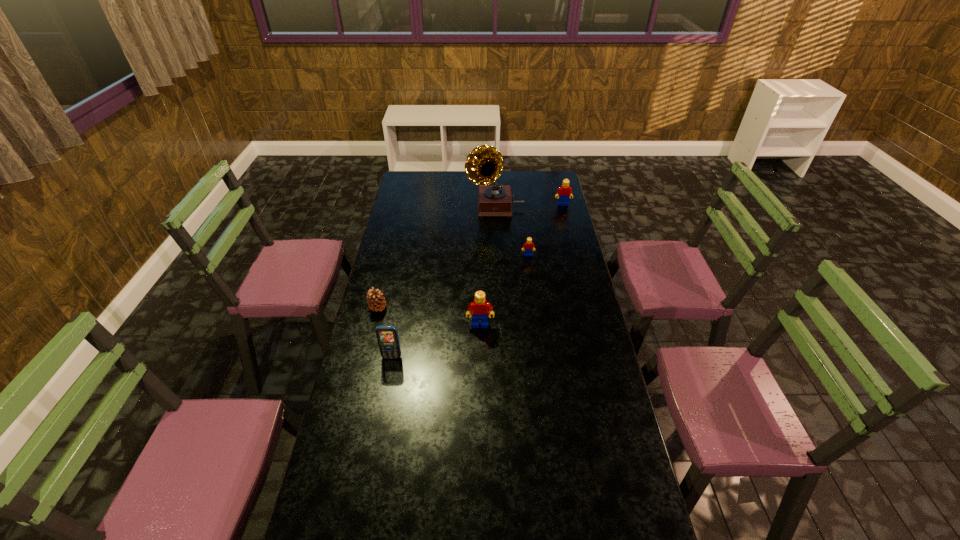
Image resolution: width=960 pixels, height=540 pixels. I want to click on pinecone that is at the left edge, so click(x=376, y=302).

Where is `object that is at the right edge`? The height and width of the screenshot is (540, 960). object that is at the right edge is located at coordinates (564, 192).

Locate an element on the screen. The image size is (960, 540). free location at the far edge of the desktop is located at coordinates (441, 190).

I want to click on vacant space at the near edge, so click(x=510, y=525).

I want to click on vacant space at the left edge of the desktop, so click(x=390, y=240).

The height and width of the screenshot is (540, 960). In the image, there is a desktop. Identify the location of vacant space at the right edge. (594, 480).

The height and width of the screenshot is (540, 960). I want to click on free space at the near right corner of the desktop, so click(x=608, y=529).

Where is `blank region between the fifth object from right to left and the second tallest Lego`? The image size is (960, 540). blank region between the fifth object from right to left and the second tallest Lego is located at coordinates (477, 281).

You are a GUI agent. You are given a task and a screenshot of the screen. Output one action in this format:
    pyautogui.click(x=<x>, y=<y>)
    Task: Click on the unoccupied area between the fourth farthest object and the third farthest object
    
    Given the screenshot: What is the action you would take?
    pyautogui.click(x=453, y=282)

You are a GUI agent. You are given a task and a screenshot of the screen. Output one action in this format:
    pyautogui.click(x=<x>, y=<y>)
    Task: Click on the free space between the rightmost Lego and the fifth object from right to left
    This screenshot has width=960, height=540.
    Given the screenshot: What is the action you would take?
    pyautogui.click(x=477, y=281)